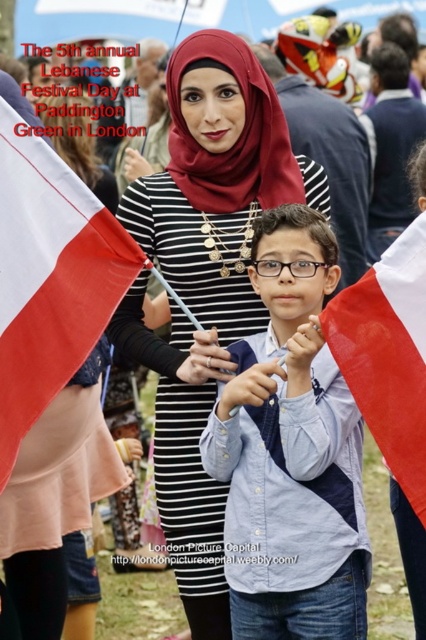
Question: From the image, what is the correct spatial relationship of blue cotton shirt at center in relation to white fabric flag at right?

Choices:
 (A) above
 (B) below

Answer: (B)

Question: Which object is positioned closest to the blue cotton shirt at center?

Choices:
 (A) matte black dress at center
 (B) white fabric flag at right
 (C) white fabric flag at left

Answer: (A)

Question: Estimate the real-world distances between objects in this image. Which object is closer to the white fabric flag at right?

Choices:
 (A) blue cotton shirt at center
 (B) matte black dress at center
 (C) white fabric flag at left

Answer: (A)

Question: Can you confirm if blue cotton shirt at center is positioned to the right of white fabric flag at right?

Choices:
 (A) no
 (B) yes

Answer: (A)

Question: Does blue cotton shirt at center have a larger size compared to white fabric flag at left?

Choices:
 (A) yes
 (B) no

Answer: (A)

Question: Which point appears closest to the camera in this image?

Choices:
 (A) [195, 506]
 (B) [25, 259]
 (C) [328, 624]

Answer: (C)